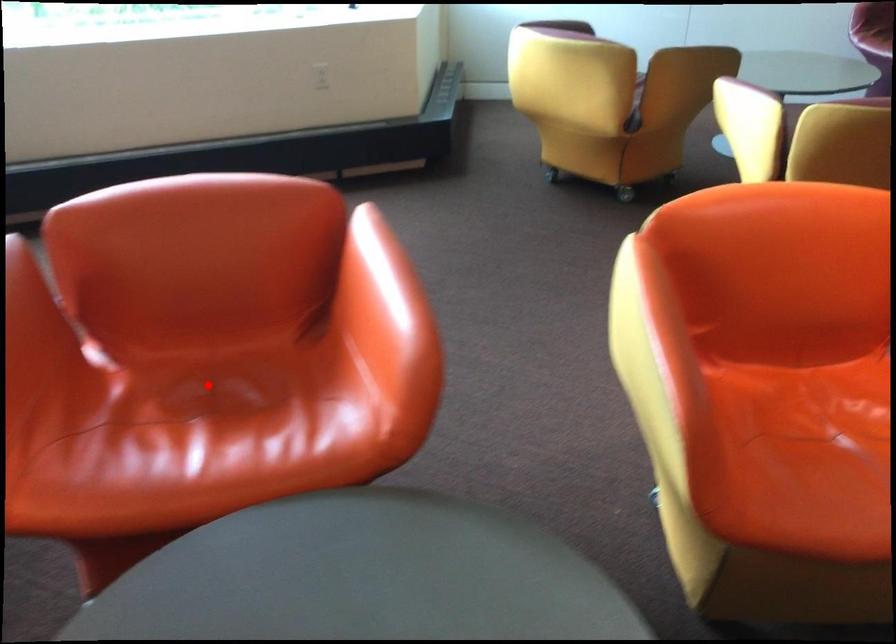
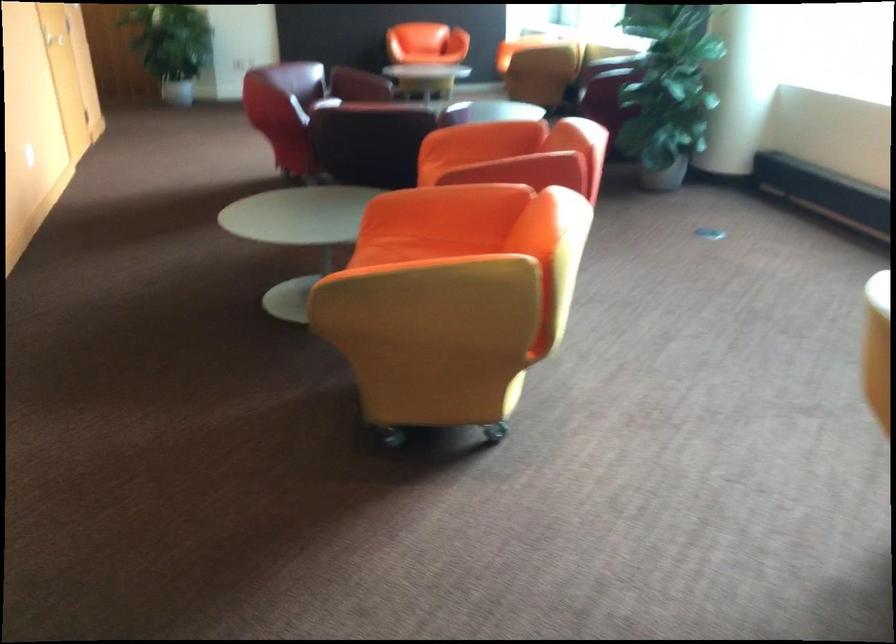
Question: I am providing you with two images of the same scene from different viewpoints. A red point is marked on the first image. Is the red point's position out of view in image 2?

Choices:
 (A) Yes
 (B) No

Answer: (A)